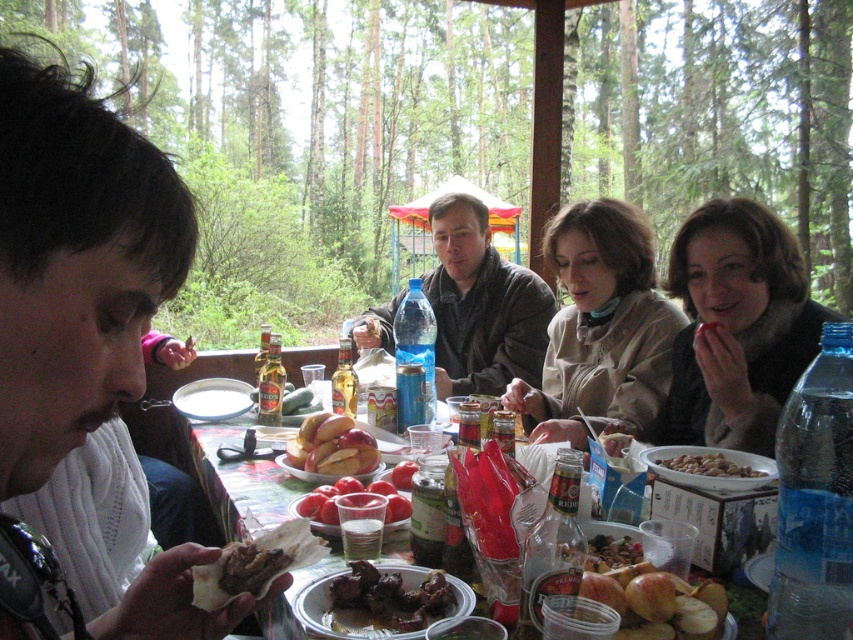
Is matte beige sweater at center positioned before shiny red apples at lower right?

No.

Is point (637, 273) closer to camera compared to point (683, 630)?

No, (637, 273) is behind (683, 630).

The image size is (853, 640). What are the coordinates of `matte beige sweater at center` in the screenshot? It's located at pyautogui.click(x=601, y=328).

Is matte beige sweater at center smaller than tomato paste at center?

No, matte beige sweater at center is not smaller than tomato paste at center.

Is matte beige sweater at center positioned in front of tomato paste at center?

No, it is behind tomato paste at center.

Who is more distant from viewer, (x=645, y=342) or (x=314, y=512)?

The point (x=645, y=342) is more distant.

Find the location of `matte beige sweater at center`. matte beige sweater at center is located at coordinates (601, 328).

Does brown woolen sweater at upper right have a greater width compared to brown crispy meat at lower left?

Yes, brown woolen sweater at upper right is wider than brown crispy meat at lower left.

The height and width of the screenshot is (640, 853). I want to click on brown woolen sweater at upper right, so click(x=735, y=326).